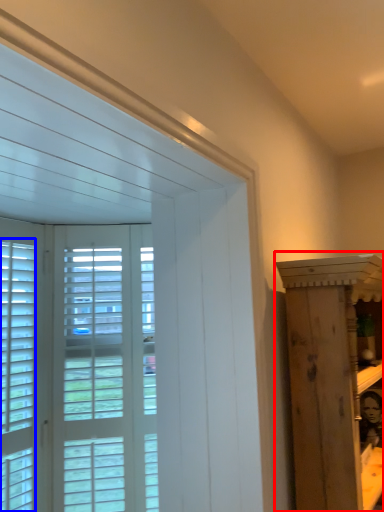
Question: Which object is closer to the camera taking this photo, furniture (highlighted by a red box) or window (highlighted by a blue box)?

Choices:
 (A) furniture
 (B) window

Answer: (A)